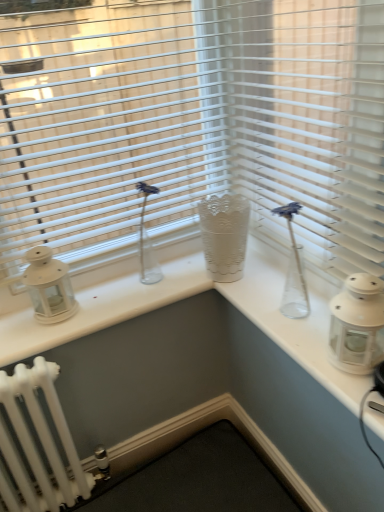
You are a GUI agent. You are given a task and a screenshot of the screen. Output one action in this format:
    pyautogui.click(x=<x>, y=<y>)
    Task: Click on the vacant space to the left of white glass lantern at right, the 2th candle holder in the left-to-right sequence
    
    Given the screenshot: What is the action you would take?
    pos(312,351)